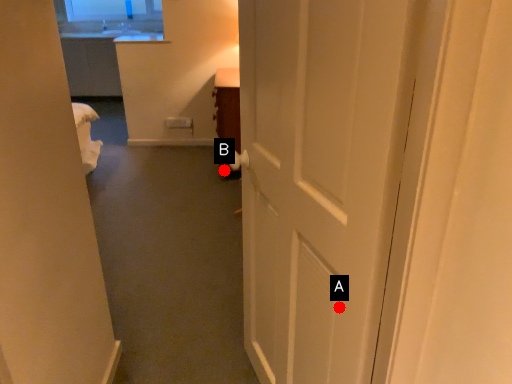
Question: Two points are circled on the image, labeled by A and B beside each circle. Which of the following is the farthest from the observer?

Choices:
 (A) A is further
 (B) B is further

Answer: (B)